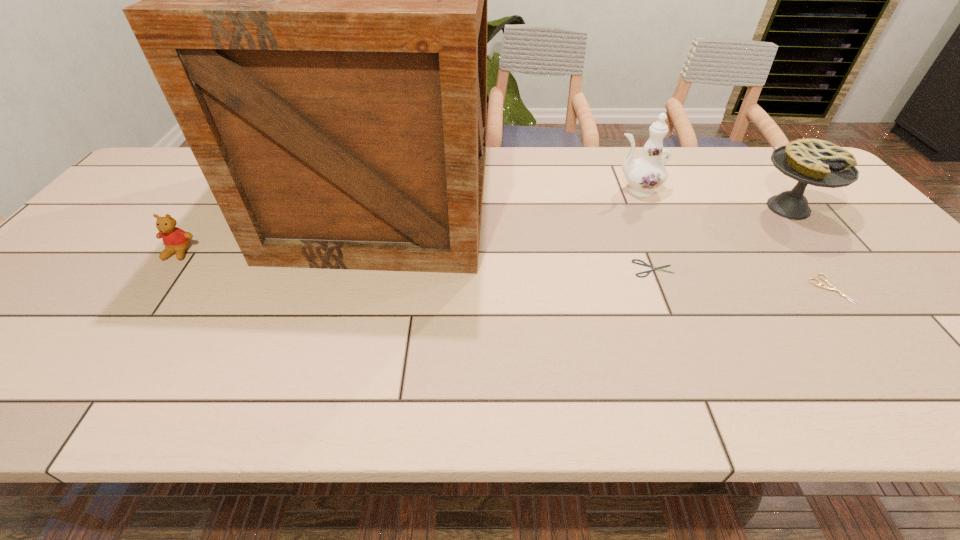
The height and width of the screenshot is (540, 960). What are the coordinates of `vacant point located between the fourth shortest object and the teddy bear` in the screenshot? It's located at (484, 230).

This screenshot has height=540, width=960. I want to click on empty space between the chinaware and the fifth object from right to left, so click(x=511, y=196).

Locate an element on the screen. vacant area between the box and the third tallest object is located at coordinates (587, 205).

I want to click on blank region between the tallest object and the shorter shears, so click(519, 235).

This screenshot has height=540, width=960. I want to click on object that is the fifth nearest to the left shears, so click(x=176, y=240).

At what (x,y) coordinates should I click in order to perform the action: click on object identified as the closest to the box. Please return your answer as a coordinate pair (x, y). The width and height of the screenshot is (960, 540). Looking at the image, I should click on [x=176, y=240].

Identify the location of vacant area in the image that satisfies the following two spatial constraints: 1. on the front-facing side of the leftmost object; 2. on the right side of the right shears. The width and height of the screenshot is (960, 540). (152, 289).